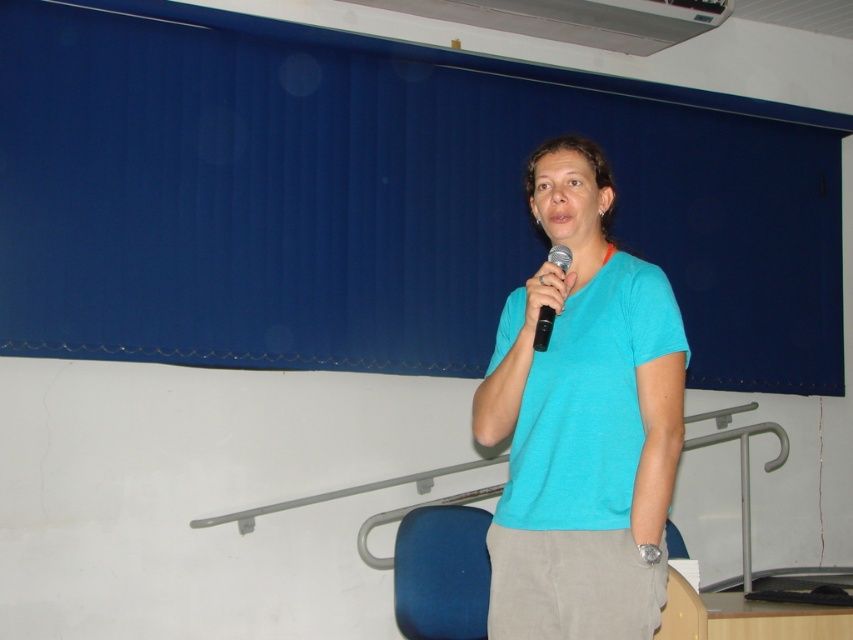
You are standing in the room and want to place a 2.5 meter long banner between the camera and the point at coordinates point (637,273). Will the banner be long enough to reach from the camera to that point?

The distance between the camera and the point (637,273) is 2.30 meters. Since the banner is 2.5 meters long, it will be long enough to reach from the camera to that point.